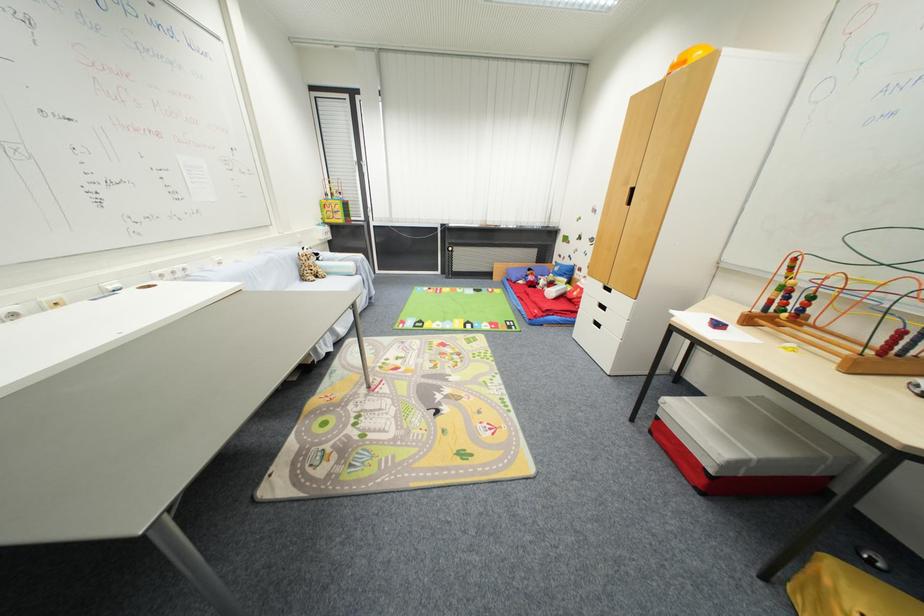
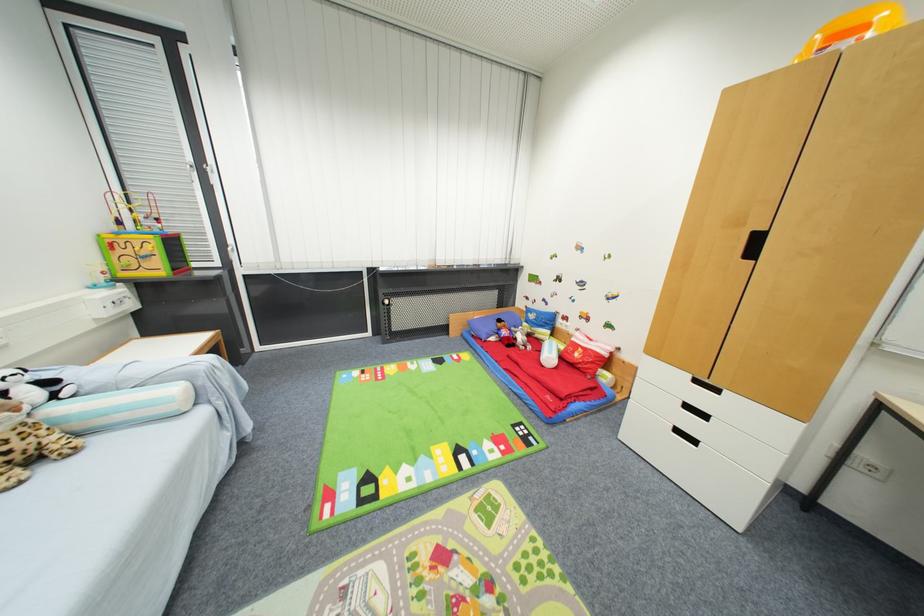
Where in the second image is the point corresponding to (x=481, y=326) from the first image?

(479, 455)